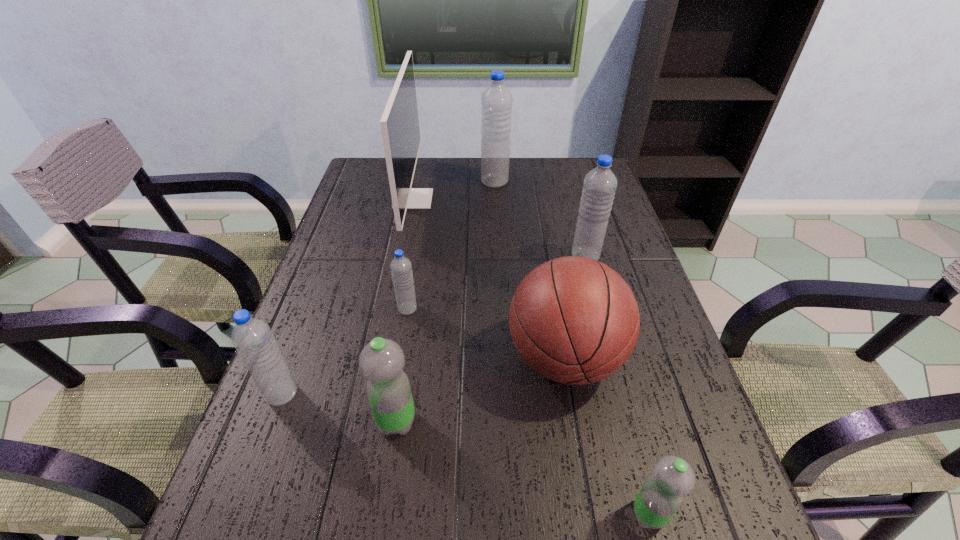
At what (x,y) coordinates should I click in order to perform the action: click on free space between the third farthest blue water bottle and the leftmost water bottle. Please return your answer as a coordinate pair (x, y). The image size is (960, 540). Looking at the image, I should click on (345, 352).

Identify the location of empty space between the fifth shortest water bottle and the nearest blue water bottle. This screenshot has width=960, height=540. (434, 325).

At what (x,y) coordinates should I click in order to perform the action: click on object that is the second closest to the smaller green water bottle. Please return your answer as a coordinate pair (x, y). The height and width of the screenshot is (540, 960). Looking at the image, I should click on (381, 361).

Select which object is the closest to the farthest water bottle. Please provide its 2D coordinates. Your answer should be formatted as a tuple, i.e. [(x, y)], where the tuple contains the x and y coordinates of a point satisfying the conditions above.

[(399, 123)]

Where is `the fourth closest water bottle relative to the basketball`? the fourth closest water bottle relative to the basketball is located at coordinates tap(401, 268).

Image resolution: width=960 pixels, height=540 pixels. I want to click on the fifth closest water bottle relative to the farthest water bottle, so click(661, 495).

Choose which blue water bottle is the second nearest neighbor to the farthest water bottle. Please provide its 2D coordinates. Your answer should be formatted as a tuple, i.e. [(x, y)], where the tuple contains the x and y coordinates of a point satisfying the conditions above.

[(401, 268)]

In order to click on blue water bottle that is the closest to the basketball in this screenshot , I will do `click(599, 185)`.

At what (x,y) coordinates should I click in order to perform the action: click on vacant region that satisfies the following two spatial constraints: 1. on the back side of the second nearest blue water bottle; 2. on the left side of the tallest water bottle. Please return your answer as a coordinate pair (x, y). Looking at the image, I should click on (428, 182).

I want to click on vacant space that satisfies the following two spatial constraints: 1. on the back side of the basketball; 2. on the left side of the third nearest blue water bottle, so click(x=547, y=256).